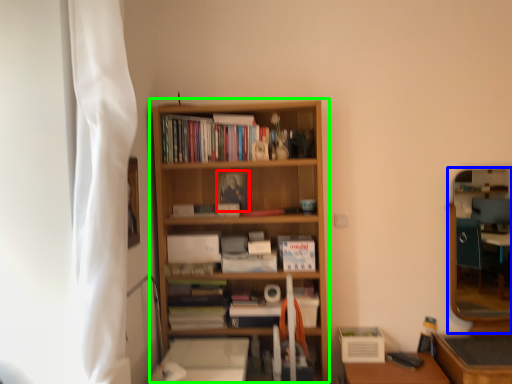
Question: Which object is the farthest from paperback book (highlighted by a red box)? Choose among these: mirror (highlighted by a blue box) or bookcase (highlighted by a green box).

Choices:
 (A) mirror
 (B) bookcase

Answer: (A)